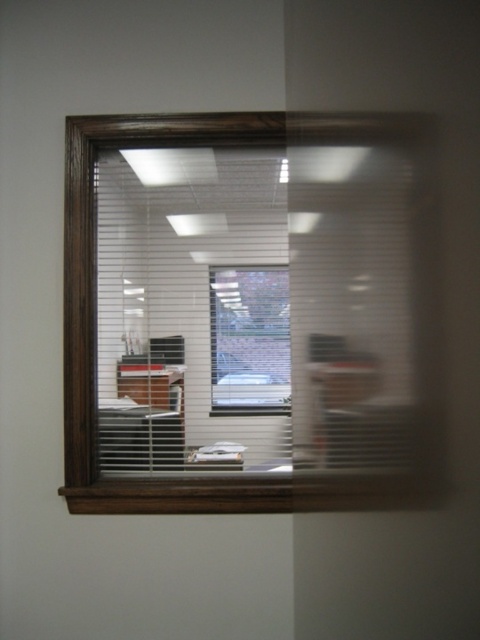
Consider the image. Is white matte blinds at center positioned at the back of brick wall at center?

No.

What do you see at coordinates (254, 310) in the screenshot? I see `white matte blinds at center` at bounding box center [254, 310].

This screenshot has height=640, width=480. I want to click on white matte blinds at center, so click(x=254, y=310).